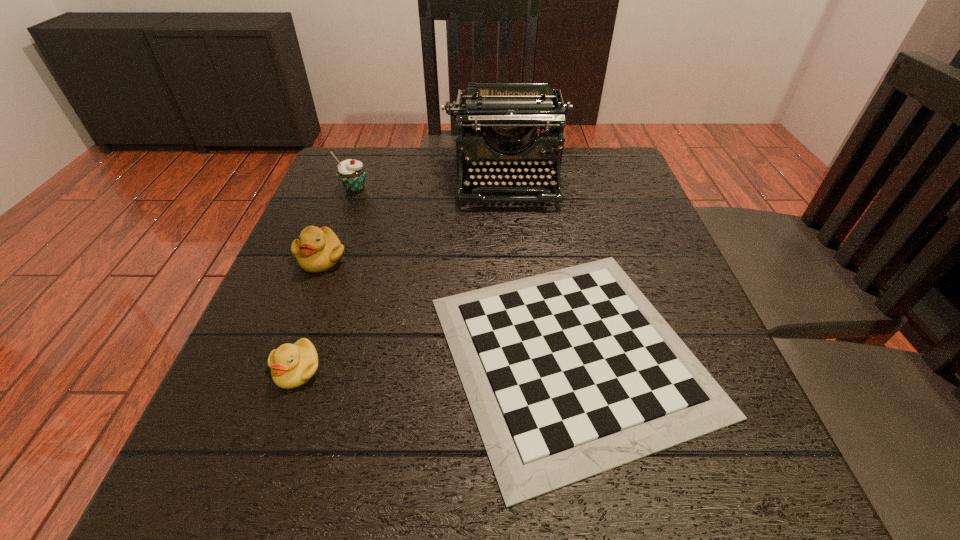
Locate an element on the screen. vacant space in between the farther duckling and the fourth shortest object is located at coordinates (338, 223).

Image resolution: width=960 pixels, height=540 pixels. What are the coordinates of `vacant space that is in between the fourth shortest object and the shortest object` in the screenshot? It's located at (463, 271).

The image size is (960, 540). Find the location of `free space between the tallest object and the cupcake`. free space between the tallest object and the cupcake is located at coordinates (431, 184).

Identify which object is the fourth closest to the taller duckling. Please provide its 2D coordinates. Your answer should be formatted as a tuple, i.e. [(x, y)], where the tuple contains the x and y coordinates of a point satisfying the conditions above.

[(507, 115)]

Find the location of a particular element. object that stands as the closest to the farther duckling is located at coordinates (352, 173).

Where is `free space that satisfies the following two spatial constraints: 1. on the front-facing side of the chessboard; 2. on the left side of the taller duckling`? The height and width of the screenshot is (540, 960). free space that satisfies the following two spatial constraints: 1. on the front-facing side of the chessboard; 2. on the left side of the taller duckling is located at coordinates (284, 354).

Identify the location of vacant area in the image that satisfies the following two spatial constraints: 1. on the front-facing side of the chessboard; 2. on the right side of the third tallest object. The image size is (960, 540). (284, 354).

This screenshot has width=960, height=540. I want to click on free point that satisfies the following two spatial constraints: 1. on the front-facing side of the taller duckling; 2. on the left side of the chessboard, so click(284, 354).